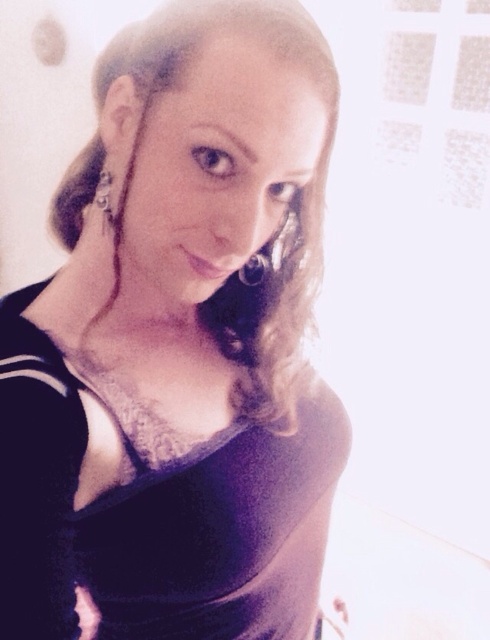
Question: Is matte black dress at center further to camera compared to silver metallic earring at left?

Choices:
 (A) yes
 (B) no

Answer: (B)

Question: Which point is farther to the camera?

Choices:
 (A) (220, 252)
 (B) (103, 205)

Answer: (B)

Question: Can you confirm if matte black dress at center is positioned to the right of silver metallic earring at left?

Choices:
 (A) no
 (B) yes

Answer: (B)

Question: Can you confirm if matte black dress at center is wider than silver metallic earring at left?

Choices:
 (A) yes
 (B) no

Answer: (A)